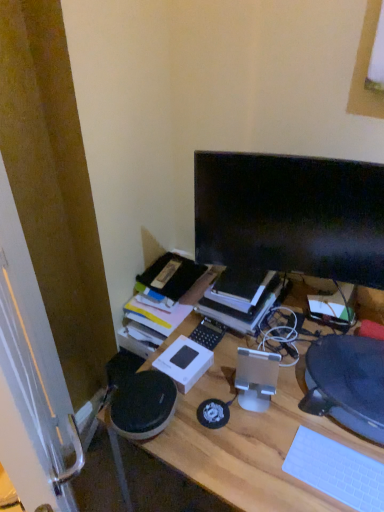
Identify the location of blank space to the left of black textured computer chair at right. Image resolution: width=384 pixels, height=512 pixels. (260, 401).